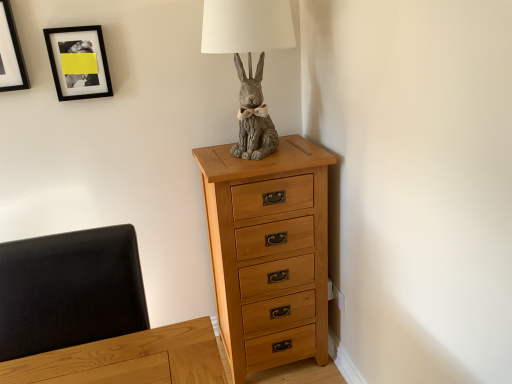
The image size is (512, 384). Find the location of `matte black picture frame at upper left, arranged as the second picture frame when viewed from the right`. matte black picture frame at upper left, arranged as the second picture frame when viewed from the right is located at coordinates (10, 53).

Identify the location of natural wood chest of drawers at center. (269, 252).

You are a GUI agent. You are given a task and a screenshot of the screen. Output one action in this format:
    pyautogui.click(x=<x>, y=<y>)
    Task: Click on the black leather swivel chair at left
    The height and width of the screenshot is (384, 512).
    Given the screenshot: What is the action you would take?
    pyautogui.click(x=70, y=290)

I want to click on matte black picture frame at upper left, arranged as the second picture frame when viewed from the right, so click(10, 53).

Which object is positioned more to the left, black leather swivel chair at left or natural wood chest of drawers at center?

Positioned to the left is black leather swivel chair at left.

How far apart are black leather swivel chair at left and natural wood chest of drawers at center?

black leather swivel chair at left is 68.49 centimeters away from natural wood chest of drawers at center.

Image resolution: width=512 pixels, height=384 pixels. Find the location of `chest of drawers behind the black leather swivel chair at left`. chest of drawers behind the black leather swivel chair at left is located at coordinates (269, 252).

Does black leather swivel chair at left have a greater width compared to natural wood chest of drawers at center?

No, black leather swivel chair at left is not wider than natural wood chest of drawers at center.

From a real-world perspective, between black leather swivel chair at left and black matte picture frame at upper left, the 1th picture frame from the right, who is vertically higher?

black matte picture frame at upper left, the 1th picture frame from the right.

Is the position of black leather swivel chair at left less distant than that of black matte picture frame at upper left, which is counted as the second picture frame, starting from the left?

Yes, it is in front of black matte picture frame at upper left, which is counted as the second picture frame, starting from the left.

Is black leather swivel chair at left next to black matte picture frame at upper left, the 1th picture frame from the right, and touching it?

No, black leather swivel chair at left is not in contact with black matte picture frame at upper left, the 1th picture frame from the right.

What's the angular difference between black leather swivel chair at left and black matte picture frame at upper left, which is counted as the second picture frame, starting from the left,'s facing directions?

There is a 0.714-degree angle between the facing directions of black leather swivel chair at left and black matte picture frame at upper left, which is counted as the second picture frame, starting from the left.

Would you say gray stone rabbit at center is to the left or to the right of black leather swivel chair at left in the picture?

In the image, gray stone rabbit at center appears on the right side of black leather swivel chair at left.

From the image's perspective, would you say gray stone rabbit at center is positioned over black leather swivel chair at left?

Yes, from the image's perspective, gray stone rabbit at center is on top of black leather swivel chair at left.

Considering the sizes of objects gray stone rabbit at center and black leather swivel chair at left in the image provided, who is smaller, gray stone rabbit at center or black leather swivel chair at left?

Smaller between the two is black leather swivel chair at left.

Is gray stone rabbit at center facing away from black leather swivel chair at left?

No, black leather swivel chair at left is not at the back of gray stone rabbit at center.

Is point (106, 94) in front of point (8, 49)?

No, it is not.

Would you say black matte picture frame at upper left, which is counted as the second picture frame, starting from the left, is to the left or to the right of matte black picture frame at upper left, arranged as the second picture frame when viewed from the right, in the picture?

black matte picture frame at upper left, which is counted as the second picture frame, starting from the left, is positioned on matte black picture frame at upper left, arranged as the second picture frame when viewed from the right,'s right side.

Choose the correct answer: Is black matte picture frame at upper left, which is counted as the second picture frame, starting from the left, inside matte black picture frame at upper left, arranged as the second picture frame when viewed from the right, or outside it?

black matte picture frame at upper left, which is counted as the second picture frame, starting from the left, cannot be found inside matte black picture frame at upper left, arranged as the second picture frame when viewed from the right.

How different are the orientations of black matte picture frame at upper left, the 1th picture frame from the right, and matte black picture frame at upper left, which is the first picture frame from left to right, in degrees?

The angle between the facing direction of black matte picture frame at upper left, the 1th picture frame from the right, and the facing direction of matte black picture frame at upper left, which is the first picture frame from left to right, is 0.000162 degrees.

From a real-world perspective, is natural wood chest of drawers at center on top of black matte picture frame at upper left, which is counted as the second picture frame, starting from the left?

No, from a real-world perspective, natural wood chest of drawers at center is not above black matte picture frame at upper left, which is counted as the second picture frame, starting from the left.

Considering the relative positions of natural wood chest of drawers at center and black matte picture frame at upper left, which is counted as the second picture frame, starting from the left, in the image provided, is natural wood chest of drawers at center in front of black matte picture frame at upper left, which is counted as the second picture frame, starting from the left,?

That is True.

Is point (305, 194) less distant than point (88, 84)?

Yes.

Is natural wood chest of drawers at center turned away from black matte picture frame at upper left, the 1th picture frame from the right?

No, natural wood chest of drawers at center's orientation is not away from black matte picture frame at upper left, the 1th picture frame from the right.

Which is more to the left, black matte picture frame at upper left, the 1th picture frame from the right, or black leather swivel chair at left?

From the viewer's perspective, black matte picture frame at upper left, the 1th picture frame from the right, appears more on the left side.

From the image's perspective, does black matte picture frame at upper left, which is counted as the second picture frame, starting from the left, appear lower than black leather swivel chair at left?

Incorrect, from the image's perspective, black matte picture frame at upper left, which is counted as the second picture frame, starting from the left, is higher than black leather swivel chair at left.

From the picture: Is black matte picture frame at upper left, the 1th picture frame from the right, in contact with black leather swivel chair at left?

No, black matte picture frame at upper left, the 1th picture frame from the right, is not in contact with black leather swivel chair at left.

From a real-world perspective, is black matte picture frame at upper left, the 1th picture frame from the right, beneath black leather swivel chair at left?

Incorrect, from a real-world perspective, black matte picture frame at upper left, the 1th picture frame from the right, is higher than black leather swivel chair at left.

Is gray stone rabbit at center oriented away from matte black picture frame at upper left, arranged as the second picture frame when viewed from the right?

No, gray stone rabbit at center is not facing the opposite direction of matte black picture frame at upper left, arranged as the second picture frame when viewed from the right.

Measure the distance from gray stone rabbit at center to matte black picture frame at upper left, which is the first picture frame from left to right.

The distance of gray stone rabbit at center from matte black picture frame at upper left, which is the first picture frame from left to right, is 31.62 inches.

This screenshot has width=512, height=384. What are the coordinates of `the 2nd picture frame to the left of the gray stone rabbit at center, starting your count from the anchor` in the screenshot? It's located at (10, 53).

Is gray stone rabbit at center shorter than matte black picture frame at upper left, arranged as the second picture frame when viewed from the right?

Incorrect, the height of gray stone rabbit at center does not fall short of that of matte black picture frame at upper left, arranged as the second picture frame when viewed from the right.

Locate an element on the screen. This screenshot has width=512, height=384. swivel chair that appears below the natural wood chest of drawers at center (from the image's perspective) is located at coordinates (70, 290).

You are a GUI agent. You are given a task and a screenshot of the screen. Output one action in this format:
    pyautogui.click(x=<x>, y=<y>)
    Task: Click on the swivel chair that is in front of the black matte picture frame at upper left, the 1th picture frame from the right
    This screenshot has height=384, width=512.
    Given the screenshot: What is the action you would take?
    pyautogui.click(x=70, y=290)

Considering their positions, is natural wood chest of drawers at center positioned further to matte black picture frame at upper left, arranged as the second picture frame when viewed from the right, than black matte picture frame at upper left, which is counted as the second picture frame, starting from the left?

natural wood chest of drawers at center lies further to matte black picture frame at upper left, arranged as the second picture frame when viewed from the right, than the other object.

When comparing their distances from gray stone rabbit at center, does matte black picture frame at upper left, which is the first picture frame from left to right, or natural wood chest of drawers at center seem closer?

Based on the image, natural wood chest of drawers at center appears to be nearer to gray stone rabbit at center.

Estimate the real-world distances between objects in this image. Which object is further from gray stone rabbit at center, black leather swivel chair at left or natural wood chest of drawers at center?

The object further to gray stone rabbit at center is black leather swivel chair at left.

When comparing their distances from matte black picture frame at upper left, which is the first picture frame from left to right, does natural wood chest of drawers at center or gray stone rabbit at center seem closer?

gray stone rabbit at center.

Consider the image. Estimate the real-world distances between objects in this image. Which object is further from black leather swivel chair at left, black matte picture frame at upper left, the 1th picture frame from the right, or gray stone rabbit at center?

black matte picture frame at upper left, the 1th picture frame from the right.

From the image, which object appears to be farther from matte black picture frame at upper left, arranged as the second picture frame when viewed from the right, black leather swivel chair at left or gray stone rabbit at center?

The object further to matte black picture frame at upper left, arranged as the second picture frame when viewed from the right, is black leather swivel chair at left.

When comparing their distances from matte black picture frame at upper left, arranged as the second picture frame when viewed from the right, does black matte picture frame at upper left, which is counted as the second picture frame, starting from the left, or natural wood chest of drawers at center seem closer?

black matte picture frame at upper left, which is counted as the second picture frame, starting from the left, is positioned closer to the anchor matte black picture frame at upper left, arranged as the second picture frame when viewed from the right.

Based on the photo, when comparing their distances from gray stone rabbit at center, does black matte picture frame at upper left, which is counted as the second picture frame, starting from the left, or black leather swivel chair at left seem closer?

black matte picture frame at upper left, which is counted as the second picture frame, starting from the left, lies closer to gray stone rabbit at center than the other object.

Where is `table lamp that lies between black matte picture frame at upper left, which is counted as the second picture frame, starting from the left, and natural wood chest of drawers at center from top to bottom`? This screenshot has width=512, height=384. table lamp that lies between black matte picture frame at upper left, which is counted as the second picture frame, starting from the left, and natural wood chest of drawers at center from top to bottom is located at coordinates (249, 61).

Where is `picture frame that lies between matte black picture frame at upper left, which is the first picture frame from left to right, and black leather swivel chair at left from top to bottom`? picture frame that lies between matte black picture frame at upper left, which is the first picture frame from left to right, and black leather swivel chair at left from top to bottom is located at coordinates (78, 62).

At what (x,y) coordinates should I click in order to perform the action: click on table lamp located between matte black picture frame at upper left, arranged as the second picture frame when viewed from the right, and natural wood chest of drawers at center in the left-right direction. Please return your answer as a coordinate pair (x, y). The height and width of the screenshot is (384, 512). Looking at the image, I should click on (x=249, y=61).

Identify the location of picture frame between matte black picture frame at upper left, which is the first picture frame from left to right, and natural wood chest of drawers at center, in the horizontal direction. (78, 62).